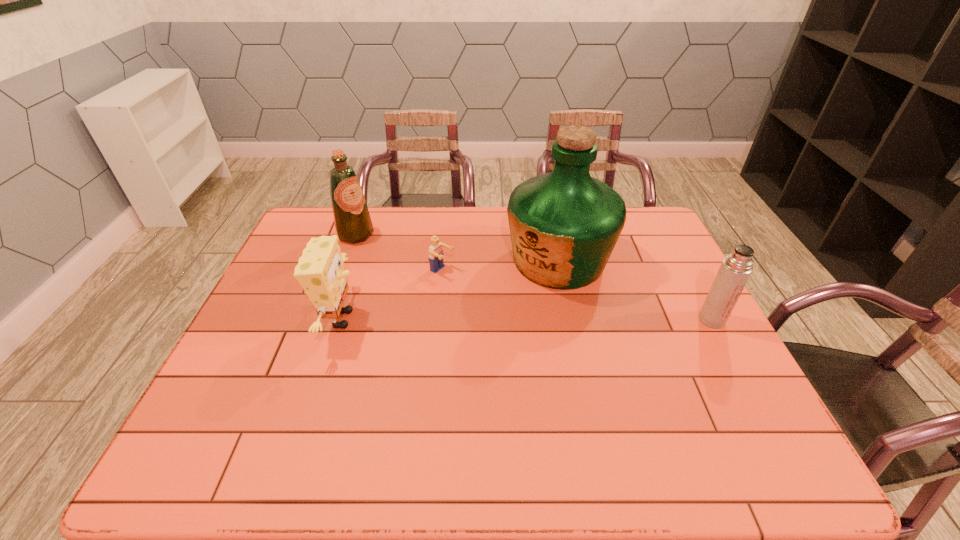
The height and width of the screenshot is (540, 960). In order to click on vacant position located on the face of the Lego in this screenshot , I will do `click(492, 298)`.

At what (x,y) coordinates should I click in order to perform the action: click on free space located 0.210m on the face of the Lego. Please return your answer as a coordinate pair (x, y). Looking at the image, I should click on (510, 307).

Identify the location of free spot located 0.370m on the label side of the liquor. (425, 355).

Locate an element on the screen. free location located 0.170m on the label side of the liquor is located at coordinates (482, 315).

Where is `free space located 0.180m on the label side of the liquor`? This screenshot has height=540, width=960. free space located 0.180m on the label side of the liquor is located at coordinates (x=479, y=317).

Locate an element on the screen. The width and height of the screenshot is (960, 540). vacant region located on the front-facing side of the olive oil is located at coordinates (431, 286).

The height and width of the screenshot is (540, 960). Identify the location of free location located 0.160m on the front-facing side of the olive oil. (397, 263).

At what (x,y) coordinates should I click in order to perform the action: click on blank space located on the front-facing side of the olive oil. Please return your answer as a coordinate pair (x, y). This screenshot has height=540, width=960. Looking at the image, I should click on (387, 256).

At what (x,y) coordinates should I click in order to perform the action: click on liquor that is at the far edge. Please return your answer as a coordinate pair (x, y). This screenshot has height=540, width=960. Looking at the image, I should click on (564, 225).

The height and width of the screenshot is (540, 960). Find the location of `olive oil that is at the far edge`. olive oil that is at the far edge is located at coordinates (353, 224).